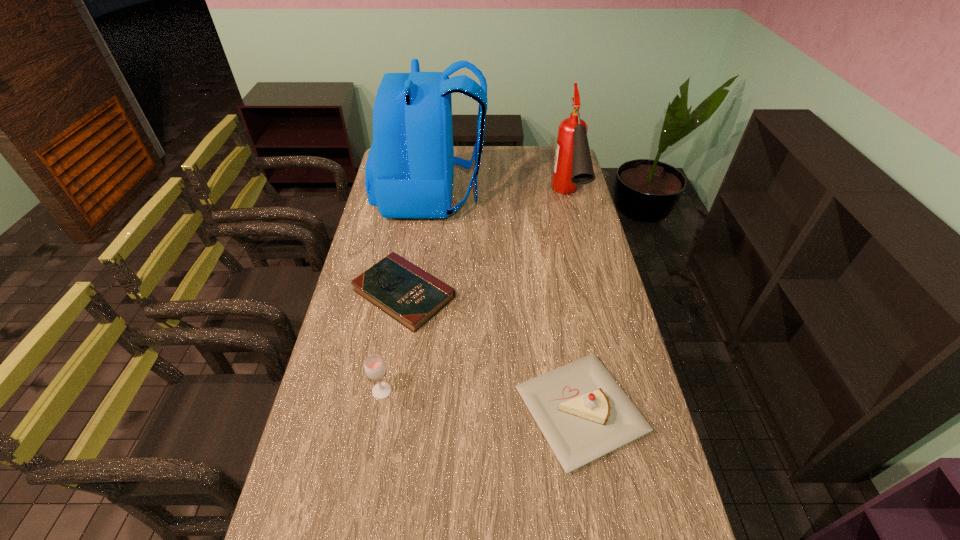
The image size is (960, 540). In order to click on free spot located 0.220m on the front of the shortest object in this screenshot , I will do `click(387, 396)`.

Image resolution: width=960 pixels, height=540 pixels. I want to click on object that is positioned at the far edge, so click(409, 171).

Identify the location of backpack present at the left edge. This screenshot has height=540, width=960. (409, 171).

Locate an element on the screen. Image resolution: width=960 pixels, height=540 pixels. wineglass at the left edge is located at coordinates (375, 368).

Identify the location of Bible that is positioned at the left edge. The width and height of the screenshot is (960, 540). (411, 296).

Identify the location of fire extinguisher that is positioned at the right edge. (572, 165).

The height and width of the screenshot is (540, 960). Find the location of `cake situated at the right edge`. cake situated at the right edge is located at coordinates (583, 413).

Find the location of `object present at the far left corner`. object present at the far left corner is located at coordinates (409, 171).

The image size is (960, 540). In the image, there is a desktop. Find the location of `free space at the left edge`. free space at the left edge is located at coordinates (344, 379).

The image size is (960, 540). In order to click on free space at the right edge of the desktop in this screenshot , I will do `click(637, 510)`.